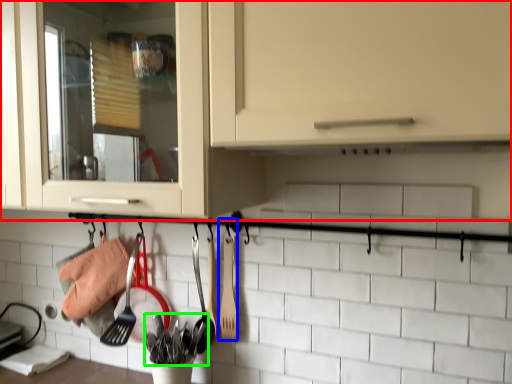
Question: Which object is the farthest from cabinetry (highlighted by a red box)? Choose among these: spatula (highlighted by a blue box) or silverware (highlighted by a green box).

Choices:
 (A) spatula
 (B) silverware

Answer: (B)